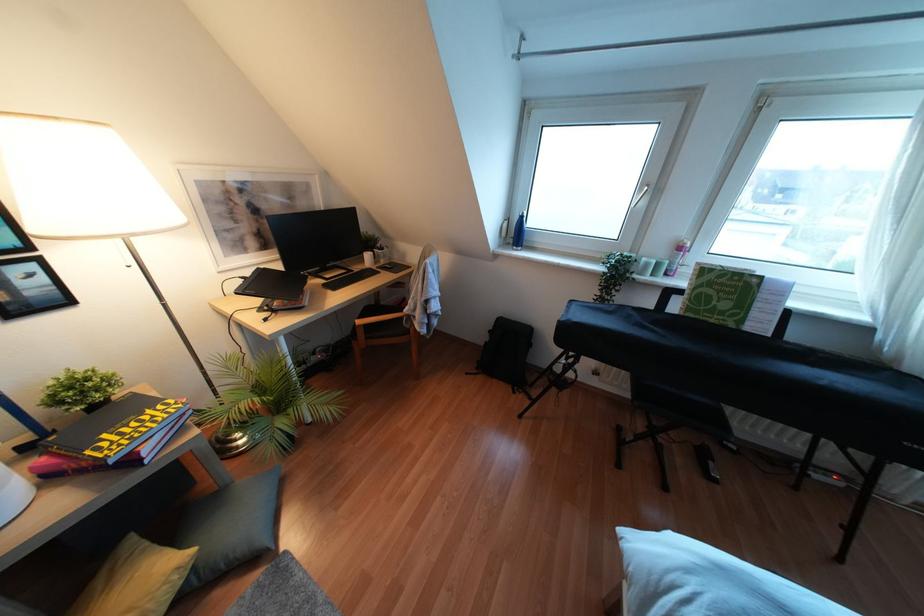
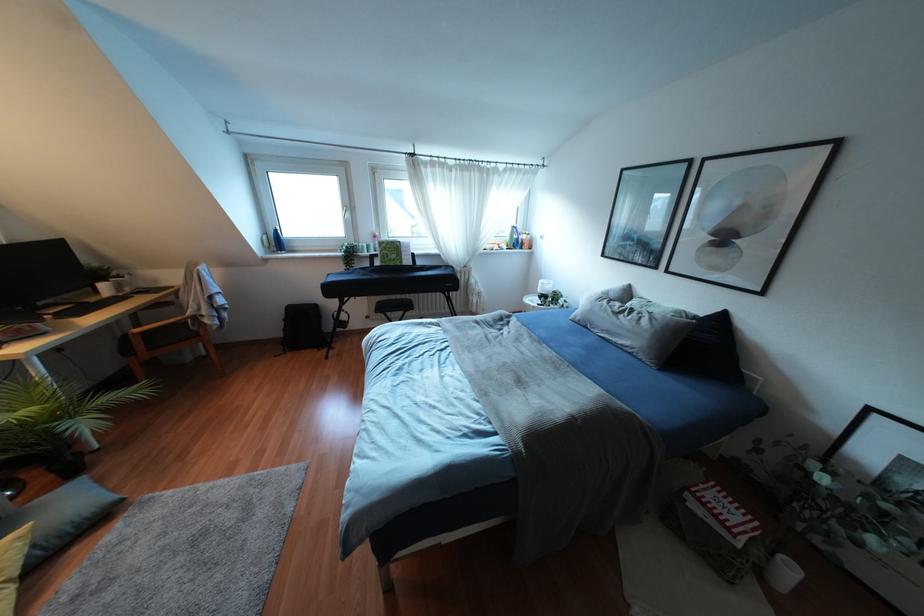
The point at (516, 233) is marked in the first image. Where is the corresponding point in the second image?

(275, 241)